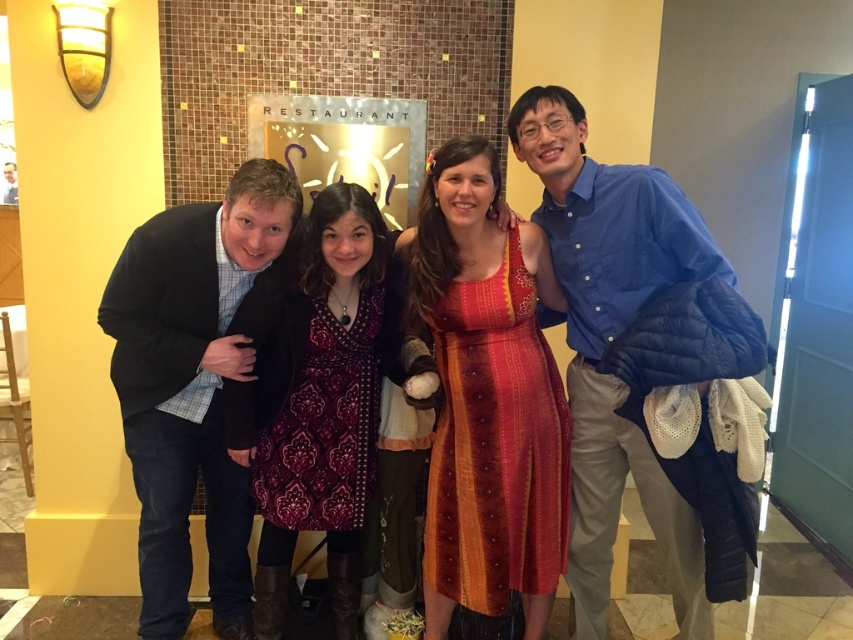
You are a photographer adjusting your camera settings. You want to focus on both the blue cotton shirt at left and the patterned fabric dress at center. Which one should you adjust your focus to first to ensure both are in sharp detail?

You should focus on the blue cotton shirt at left first since it is closer to the viewer, allowing the patterned fabric dress at center to be in focus as well through depth of field.